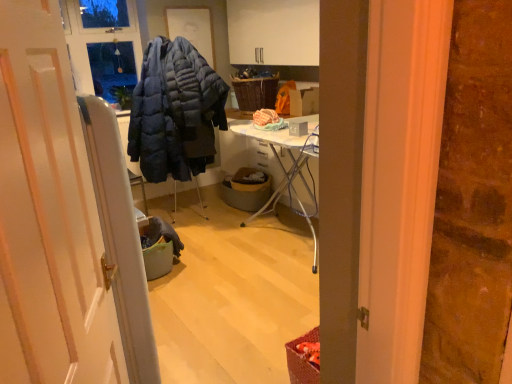
You are a GUI agent. You are given a task and a screenshot of the screen. Output one action in this format:
    pyautogui.click(x=<x>, y=<y>)
    Task: Click on the vacant region in front of brown woven basket at center
    This screenshot has height=384, width=512.
    Given the screenshot: What is the action you would take?
    pyautogui.click(x=241, y=219)